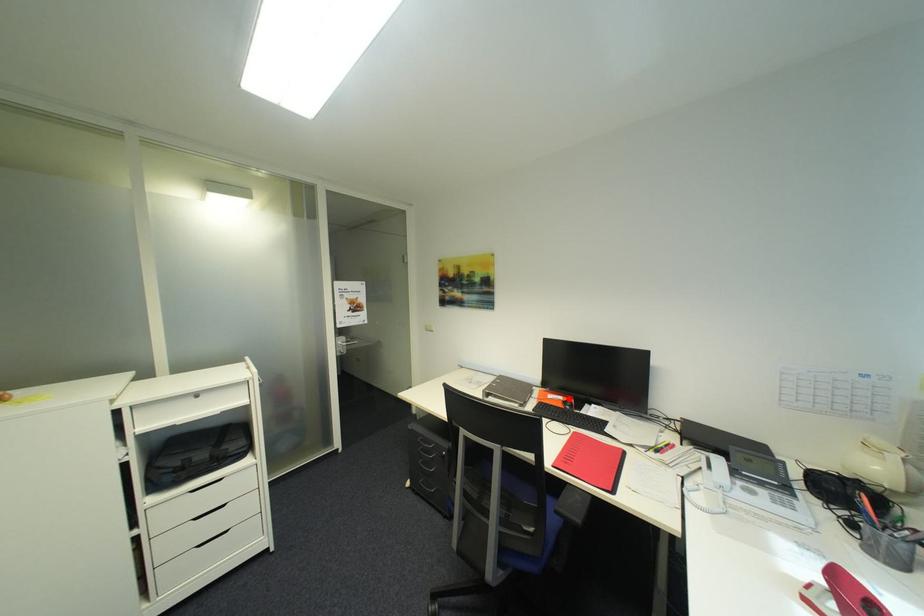
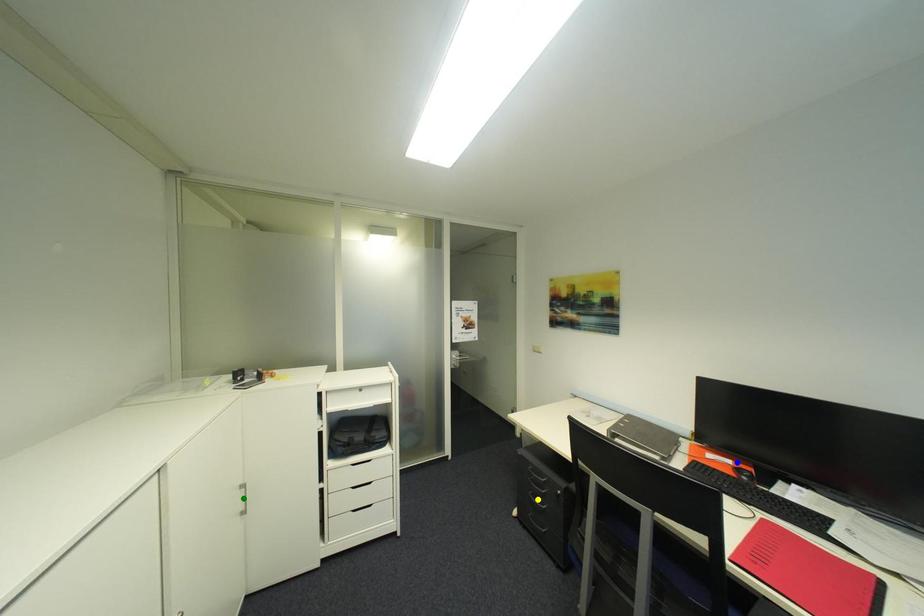
Question: I am providing you with two images of the same scene from different viewpoints. A red point is marked on the first image. You are given multiple points on the second image. Which spot in image 2 lines up with the point in image 1?

Choices:
 (A) yellow point
 (B) green point
 (C) blue point

Answer: (C)